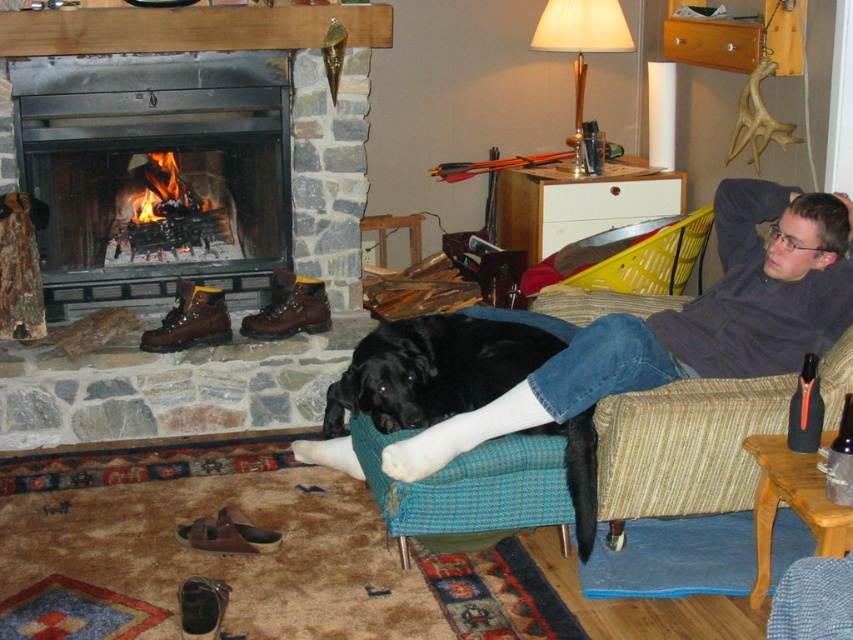
You are a visitor in this room and want to pick up the black matte bottle at right without disturbing the black soft fur at lower center. Is the bottle within your reach?

The black soft fur at lower center is closer to you than the black matte bottle at right, so you can reach the black matte bottle at right without disturbing the black soft fur at lower center.

You are a visitor in this room and want to place a 1.2 meter tall Christmas tree in the corner near the fireplace. Considering the height of the smooth stone fireplace at center and the black soft fur at lower center, will the tree fit without touching the fireplace?

The smooth stone fireplace at center is taller than the black soft fur at lower center, but the height of the fireplace itself isn not specified. Therefore, it is unclear if the 1.2 meter tall Christmas tree will fit without touching the fireplace.

From the picture: You are trying to place a black matte bottle at right on the mantel above the smooth stone fireplace at center. Can you fit it there?

The smooth stone fireplace at center might be wider than black matte bottle at right, so there is a possibility that the bottle will fit on the mantel.